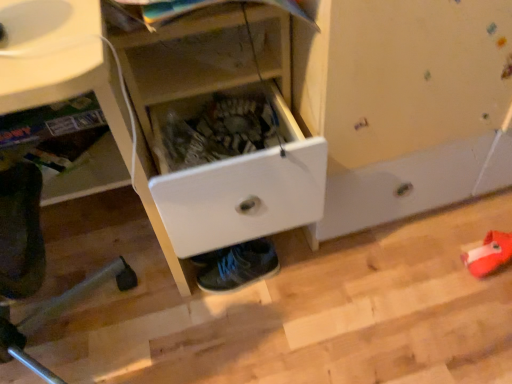
Question: Visually, is white plastic drawer at center positioned to the left or to the right of white plastic drawer at lower center?

Choices:
 (A) right
 (B) left

Answer: (A)

Question: From the image's perspective, is white plastic drawer at center located above or below white plastic drawer at lower center?

Choices:
 (A) below
 (B) above

Answer: (B)

Question: Which of these objects is positioned farthest from the white plastic drawer at center?

Choices:
 (A) white plastic drawer at center
 (B) white plastic drawer at lower center
 (C) shiny blue sneakers at lower center

Answer: (C)

Question: Which of these objects is positioned closest to the white plastic drawer at center?

Choices:
 (A) white plastic drawer at lower center
 (B) white plastic drawer at center
 (C) shiny blue sneakers at lower center

Answer: (B)